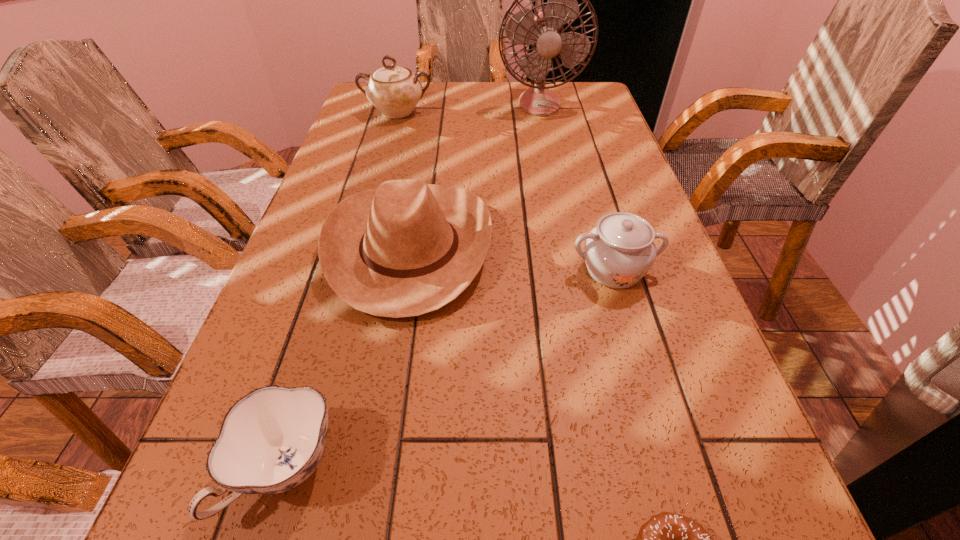
Locate an element on the screen. This screenshot has height=540, width=960. the tallest object is located at coordinates (543, 30).

Image resolution: width=960 pixels, height=540 pixels. I want to click on the farthest chinaware, so click(x=395, y=91).

Image resolution: width=960 pixels, height=540 pixels. I want to click on cowboy hat, so click(x=407, y=248).

You are a GUI agent. You are given a task and a screenshot of the screen. Output one action in this format:
    pyautogui.click(x=<x>, y=<y>)
    Task: Click on the second tallest chinaware
    The height and width of the screenshot is (540, 960).
    Given the screenshot: What is the action you would take?
    pyautogui.click(x=620, y=250)

Find the location of a particular element. The height and width of the screenshot is (540, 960). the second nearest chinaware is located at coordinates (620, 250).

Where is `the nearest chinaware`? The width and height of the screenshot is (960, 540). the nearest chinaware is located at coordinates (271, 440).

The image size is (960, 540). Identify the location of the shortest chinaware. [271, 440].

Find the location of a particular element. The image size is (960, 540). free space located 0.210m in front of the tallest object to direct airflow is located at coordinates (550, 154).

Locate an element on the screen. This screenshot has height=540, width=960. free space located 0.160m on the front of the tallest chinaware is located at coordinates (385, 153).

You are a GUI agent. You are given a task and a screenshot of the screen. Output one action in this format:
    pyautogui.click(x=<x>, y=<y>)
    Task: Click on the vacant space positioned on the front-facing side of the cowboy hat
    This screenshot has width=960, height=540.
    Given the screenshot: What is the action you would take?
    pyautogui.click(x=636, y=247)